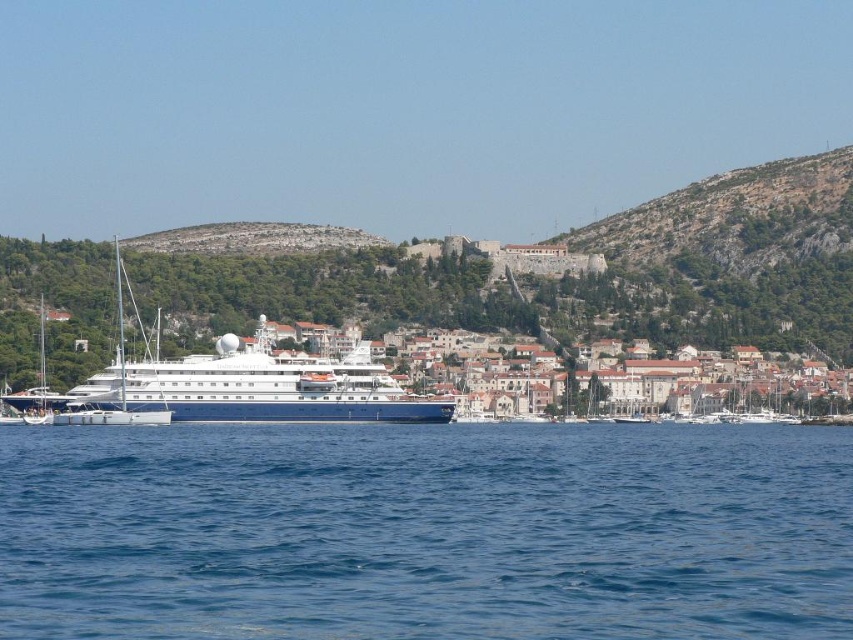
Is blue liquid water at center shorter than white glossy cruise ship at center?

Indeed, blue liquid water at center has a lesser height compared to white glossy cruise ship at center.

Is blue liquid water at center taller than white glossy cruise ship at center?

Incorrect, blue liquid water at center's height is not larger of white glossy cruise ship at center's.

Who is more forward, (225, 541) or (138, 392)?

Point (225, 541) is more forward.

At what (x,y) coordinates should I click in order to perform the action: click on blue liquid water at center. Please return your answer as a coordinate pair (x, y). Looking at the image, I should click on (426, 531).